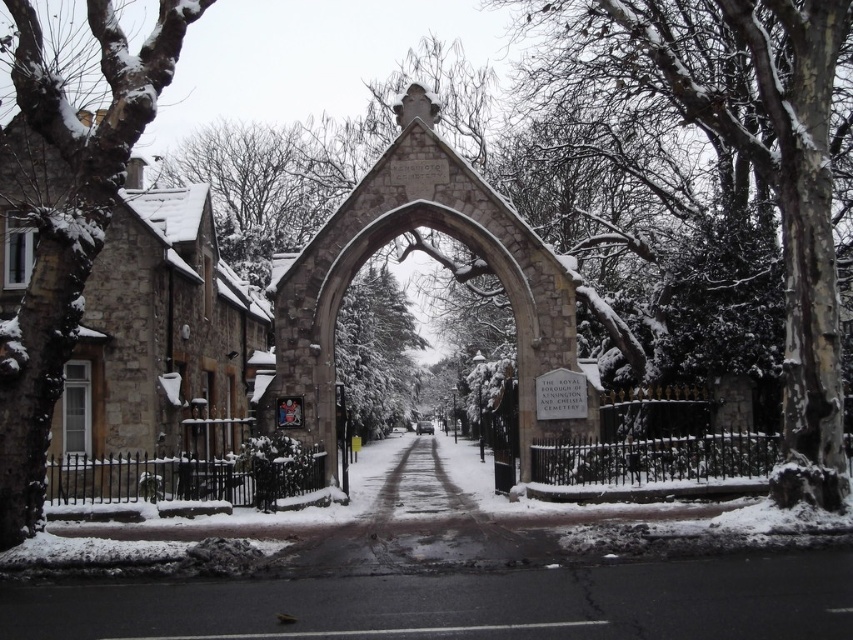
Can you confirm if snow-covered bark at center is shorter than snow-covered bark at left?

In fact, snow-covered bark at center may be taller than snow-covered bark at left.

Does snow-covered bark at center have a larger size compared to snow-covered bark at left?

Yes, snow-covered bark at center is bigger than snow-covered bark at left.

You are a GUI agent. You are given a task and a screenshot of the screen. Output one action in this format:
    pyautogui.click(x=<x>, y=<y>)
    Task: Click on the snow-covered bark at center
    The image size is (853, 640).
    Given the screenshot: What is the action you would take?
    pyautogui.click(x=752, y=164)

At what (x,y) coordinates should I click in order to perform the action: click on snow-covered bark at center. Please return your answer as a coordinate pair (x, y). The width and height of the screenshot is (853, 640). Looking at the image, I should click on (752, 164).